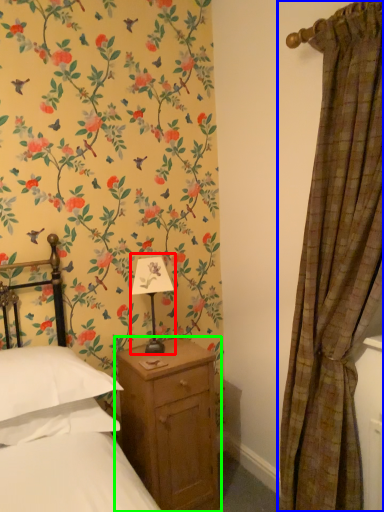
Question: Based on their relative distances, which object is farther from table lamp (highlighted by a red box)? Choose from curtain (highlighted by a blue box) and nightstand (highlighted by a green box).

Choices:
 (A) curtain
 (B) nightstand

Answer: (A)